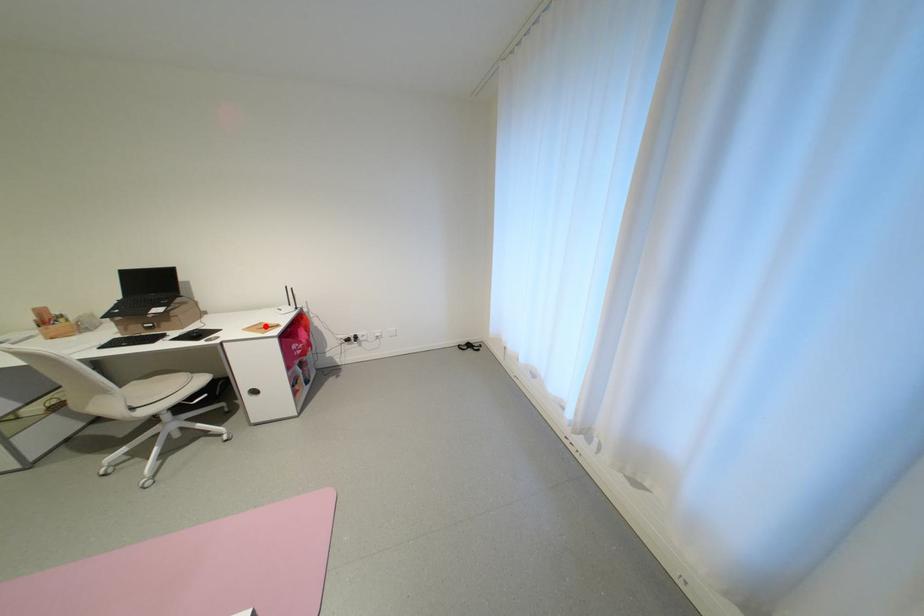
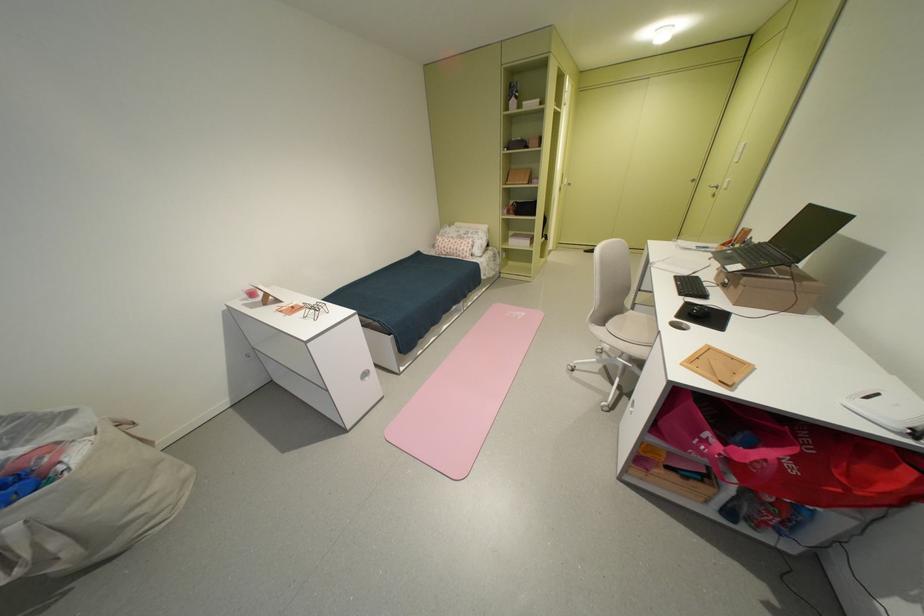
In the second image, find the point that corresponds to the highlighted location in the first image.

(743, 360)